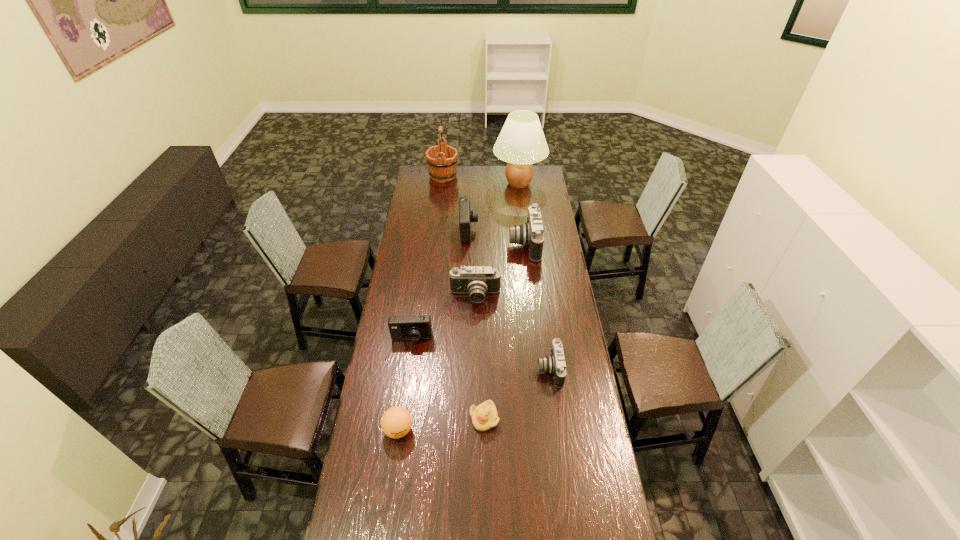
Where is `free spot that satisfies the following two spatial constraints: 1. on the front-facing side of the biggest black camera; 2. on the front-facing side of the second farthest black camera`? The width and height of the screenshot is (960, 540). free spot that satisfies the following two spatial constraints: 1. on the front-facing side of the biggest black camera; 2. on the front-facing side of the second farthest black camera is located at coordinates (530, 296).